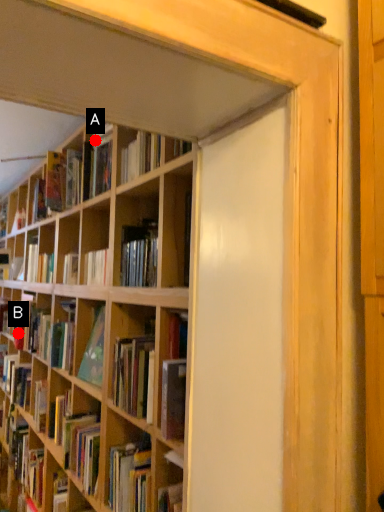
Question: Two points are circled on the image, labeled by A and B beside each circle. Which of the following is the closest to the observer?

Choices:
 (A) A is closer
 (B) B is closer

Answer: (A)